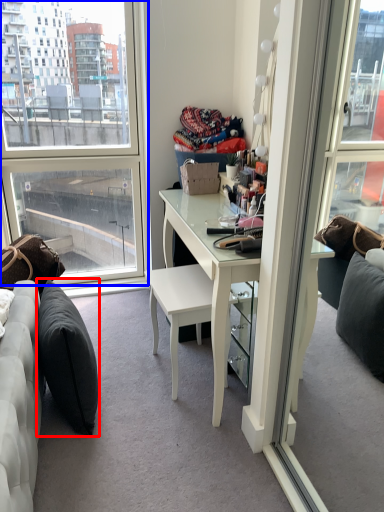
Question: Which object appears closest to the camera in this image, pillow (highlighted by a red box) or window (highlighted by a blue box)?

Choices:
 (A) pillow
 (B) window

Answer: (A)